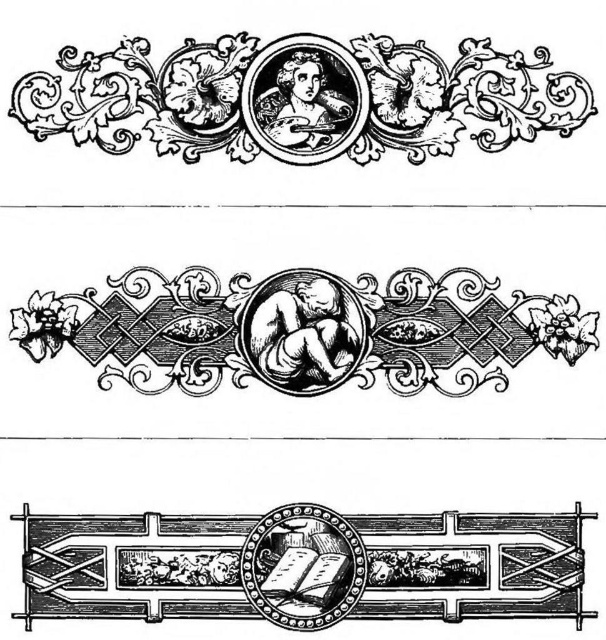
Image resolution: width=606 pixels, height=640 pixels. What do you see at coordinates (301, 99) in the screenshot?
I see `etched wood portrait at upper center` at bounding box center [301, 99].

Is point (488, 51) closer to viewer compared to point (530, 582)?

That is False.

Where is `etched wood portrait at upper center`? This screenshot has width=606, height=640. etched wood portrait at upper center is located at coordinates (301, 99).

Identify the location of etched wood portrait at upper center. This screenshot has height=640, width=606. (301, 99).

Between etched wood portrait at upper center and black ink cherub at center, which one appears on the right side from the viewer's perspective?

Positioned to the right is black ink cherub at center.

Who is shorter, etched wood portrait at upper center or black ink cherub at center?

black ink cherub at center

Between point (350, 108) and point (379, 296), which one is positioned behind?

The point (350, 108) is more distant.

Locate an element on the screen. etched wood portrait at upper center is located at coordinates coord(301,99).

Between black ink cherub at center and wooden carved frame at bottom center, which one is positioned higher?

black ink cherub at center is higher up.

Who is taller, black ink cherub at center or wooden carved frame at bottom center?

With more height is wooden carved frame at bottom center.

At what (x,y) coordinates should I click in order to perform the action: click on black ink cherub at center. Please return your answer as a coordinate pair (x, y). This screenshot has height=640, width=606. Looking at the image, I should click on (301, 330).